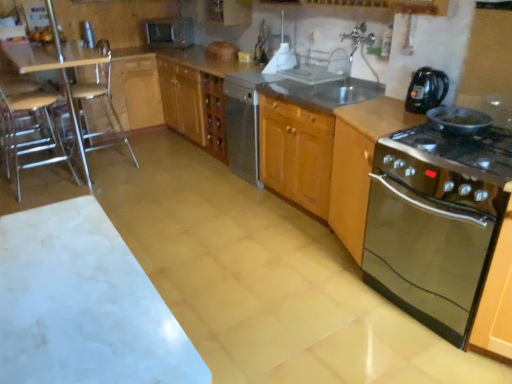
The image size is (512, 384). Find the location of `vacant space positioned to the left of black plastic kettle at upper right, the second kitchen appliance in the bottom-to-top sequence`. vacant space positioned to the left of black plastic kettle at upper right, the second kitchen appliance in the bottom-to-top sequence is located at coordinates (390, 113).